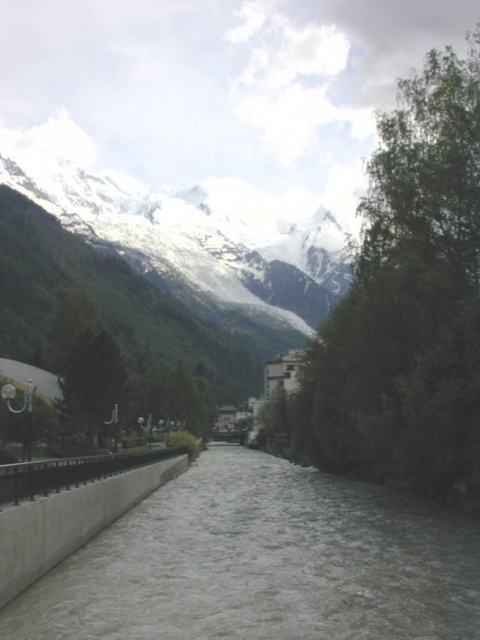
You are a hiker planning to cross the white concrete river at center using a bridge that is 100 meters long. Can you safely cross the river without needing to extend the bridge? Please explain your reasoning based on the distance between the river and the green leafy tree at upper right.

The distance between the white concrete river at center and the green leafy tree at upper right is 113.42 meters. Since the bridge is only 100 meters long, it would not be sufficient to span the gap. Therefore, the bridge needs to be extended by at least 13.42 meters to safely cross the river.